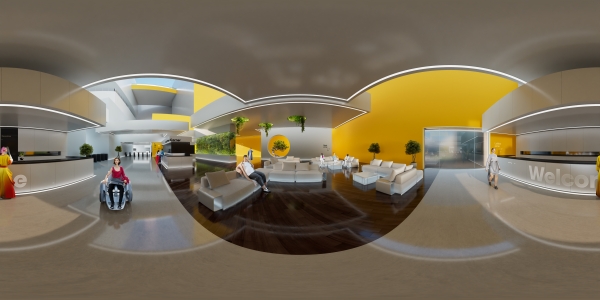
The image size is (600, 300). I want to click on lights, so click(302, 121).